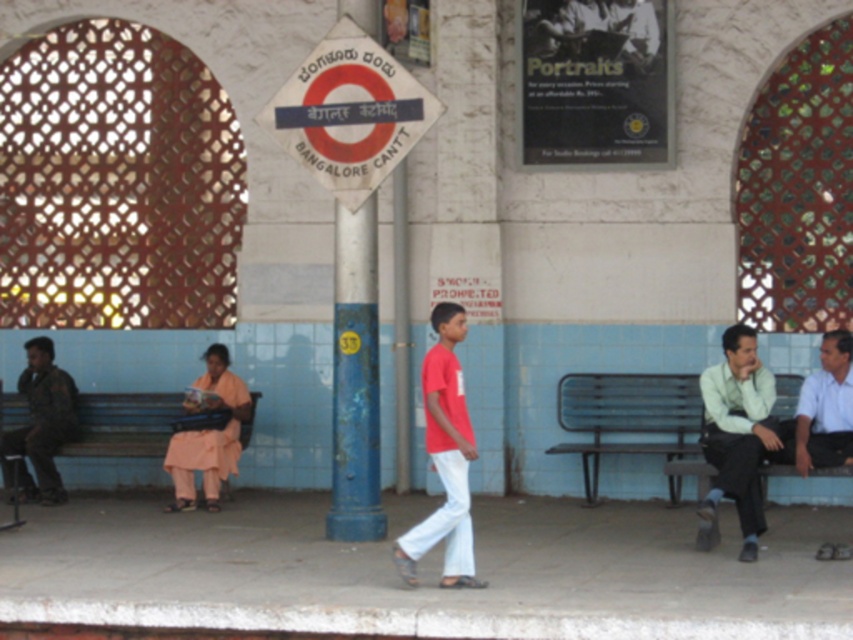
Is point (364, 40) less distant than point (456, 515)?

That is False.

Between point (361, 172) and point (448, 476), which one is positioned behind?

Point (361, 172)

The image size is (853, 640). Describe the element at coordinates (349, 113) in the screenshot. I see `white plastic sign at center` at that location.

I want to click on white plastic sign at center, so click(x=349, y=113).

Can you confirm if white plastic sign at center is positioned to the right of blue painted wood bench at center left?

Indeed, white plastic sign at center is positioned on the right side of blue painted wood bench at center left.

Who is higher up, white plastic sign at center or blue painted wood bench at center left?

white plastic sign at center

This screenshot has width=853, height=640. What are the coordinates of `white plastic sign at center` in the screenshot? It's located at (349, 113).

Which is behind, point (392, 120) or point (749, 385)?

The point (392, 120) is more distant.

Does white plastic sign at center have a lesser width compared to light green shirt at right?

Incorrect, white plastic sign at center's width is not less than light green shirt at right's.

Does point (320, 74) come closer to viewer compared to point (712, 492)?

No, (320, 74) is further to viewer.

Identify the location of white plastic sign at center. This screenshot has width=853, height=640. (349, 113).